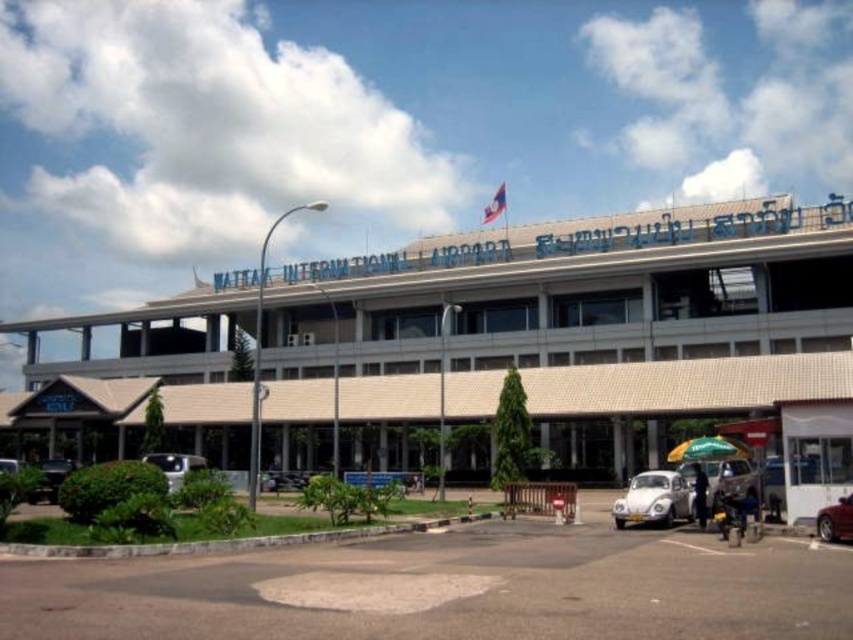
From the picture: You are standing at the entrance of Wattay International Airport and want to take a photo of the beige textured building at lower left. If you are 48.63 meters away from it, is this distance suitable for capturing the entire building in one frame with a standard camera lens?

Yes, the distance of 48.63 meters between you and the beige textured building at lower left is suitable for capturing the entire building in one frame with a standard camera lens.

You are a photographer planning to capture the Wattay International Airport exterior with both the white matte car at lower center and the white matte car at lower left in the frame. Which car should you position closer to the camera to ensure both cars appear similar in size in the photo?

To make both cars appear similar in size in the photo, position the white matte car at lower center closer to the camera since it has a lesser width compared to the white matte car at lower left. This adjustment will help balance their perceived sizes in the image.

Based on the photo, you are standing in front of Wattay International Airport and want to take a photo of the beige textured building at lower left and the white matte car at lower left. Which object should you focus on first to ensure it appears larger in your photo?

You should focus on the beige textured building at lower left first because it is closer to you than the white matte car at lower left, making it appear larger in the photo.